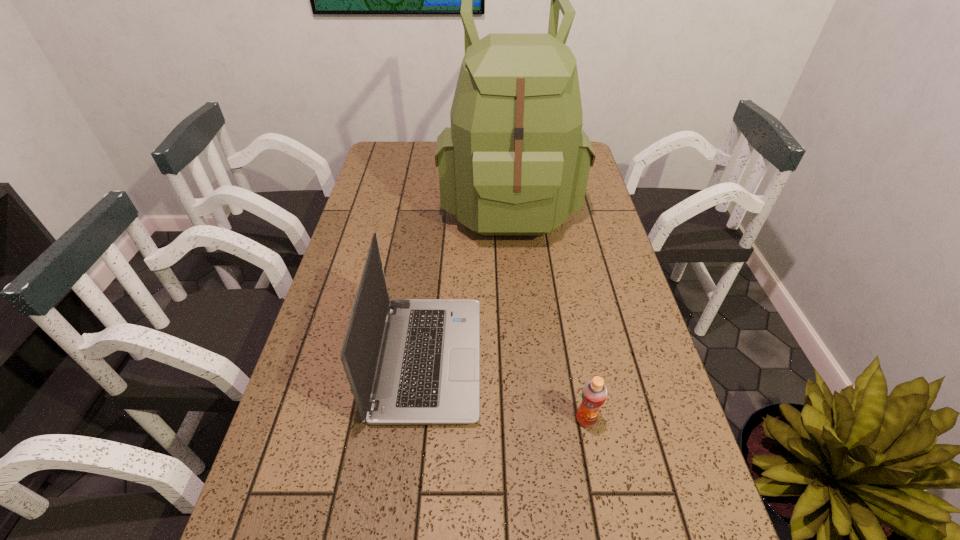
Locate an element on the screen. The height and width of the screenshot is (540, 960). the tallest object is located at coordinates (516, 161).

At what (x,y) coordinates should I click in order to perform the action: click on the farthest object. Please return your answer as a coordinate pair (x, y). This screenshot has width=960, height=540. Looking at the image, I should click on (516, 161).

Identify the location of laptop computer. (427, 373).

The image size is (960, 540). I want to click on orange juice, so click(x=594, y=393).

Locate an element on the screen. The height and width of the screenshot is (540, 960). free spot located on the front pocket of the farthest object is located at coordinates (520, 338).

The width and height of the screenshot is (960, 540). Find the location of `vacant space located 0.080m on the screen of the second shortest object`. vacant space located 0.080m on the screen of the second shortest object is located at coordinates (514, 359).

This screenshot has width=960, height=540. Identify the location of free space located 0.160m on the left of the shortest object. (498, 419).

You are a GUI agent. You are given a task and a screenshot of the screen. Output one action in this format:
    pyautogui.click(x=<x>, y=<y>)
    Task: Click on the object present at the far edge
    The width and height of the screenshot is (960, 540).
    Given the screenshot: What is the action you would take?
    pyautogui.click(x=516, y=161)

Locate an element on the screen. The height and width of the screenshot is (540, 960). object that is at the right edge is located at coordinates (516, 161).

The image size is (960, 540). Find the location of `object situated at the far right corner`. object situated at the far right corner is located at coordinates (516, 161).